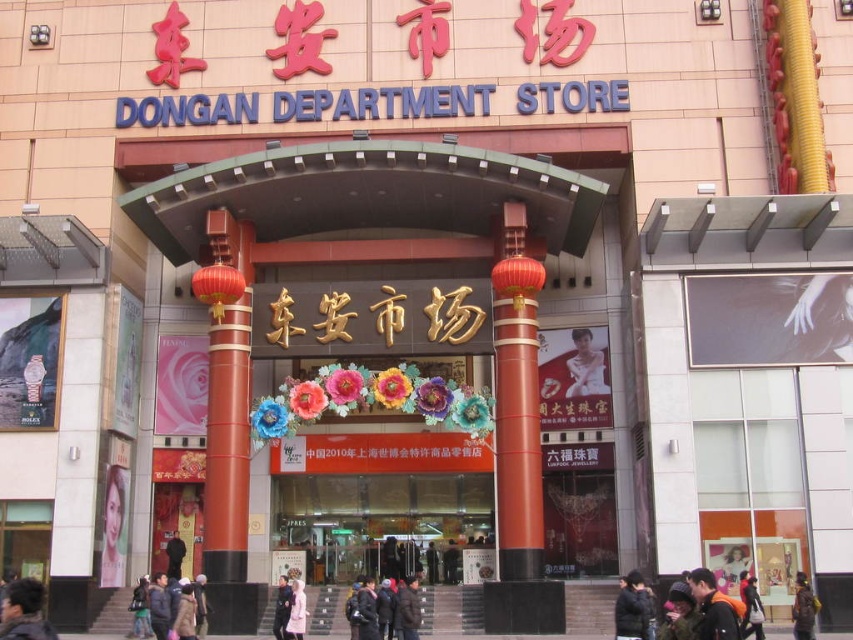
Question: Which point is closer to the camera?

Choices:
 (A) dark brown hair at lower left
 (B) dark blue jacket at center
 (C) dark gray puffer jacket at lower center

Answer: (A)

Question: Is black matte jacket at lower right to the left of dark blue jacket at center from the viewer's perspective?

Choices:
 (A) yes
 (B) no

Answer: (B)

Question: Considering the real-world distances, which object is closest to the dark brown leather jacket at lower right?

Choices:
 (A) dark blue jacket at center
 (B) dark brown hair at lower left
 (C) light pink fabric coat at center

Answer: (C)

Question: Does black matte jacket at lower right come in front of light pink fabric coat at center?

Choices:
 (A) no
 (B) yes

Answer: (B)

Question: Which object is farther from the camera taking this photo?

Choices:
 (A) black matte jacket at lower right
 (B) dark gray puffer jacket at lower center

Answer: (B)

Question: Does dark brown hair at lower left have a larger size compared to orange fabric jacket at lower right?

Choices:
 (A) yes
 (B) no

Answer: (A)